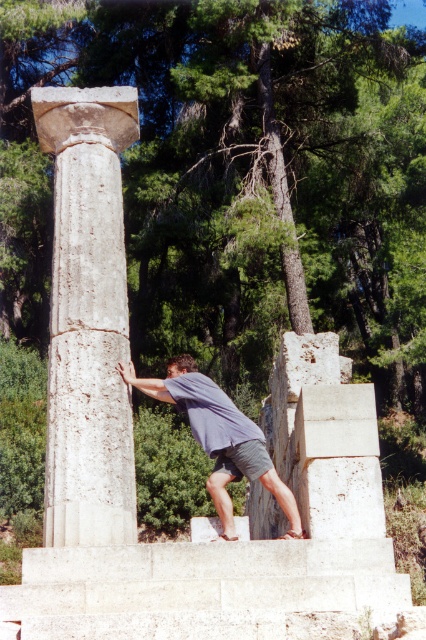
Question: Can you confirm if white marble column at left is bigger than gray fabric shirt at center?

Choices:
 (A) no
 (B) yes

Answer: (B)

Question: Does white marble column at left appear on the right side of gray fabric shirt at center?

Choices:
 (A) yes
 (B) no

Answer: (B)

Question: Does white marble column at left have a lesser width compared to gray fabric shirt at center?

Choices:
 (A) no
 (B) yes

Answer: (B)

Question: Which object appears closest to the camera in this image?

Choices:
 (A) white marble column at left
 (B) gray fabric shirt at center

Answer: (A)

Question: Which of the following is the closest to the observer?

Choices:
 (A) (229, 515)
 (B) (85, 209)

Answer: (A)

Question: Which object is farther from the camera taking this photo?

Choices:
 (A) white marble column at left
 (B) gray fabric shirt at center

Answer: (B)